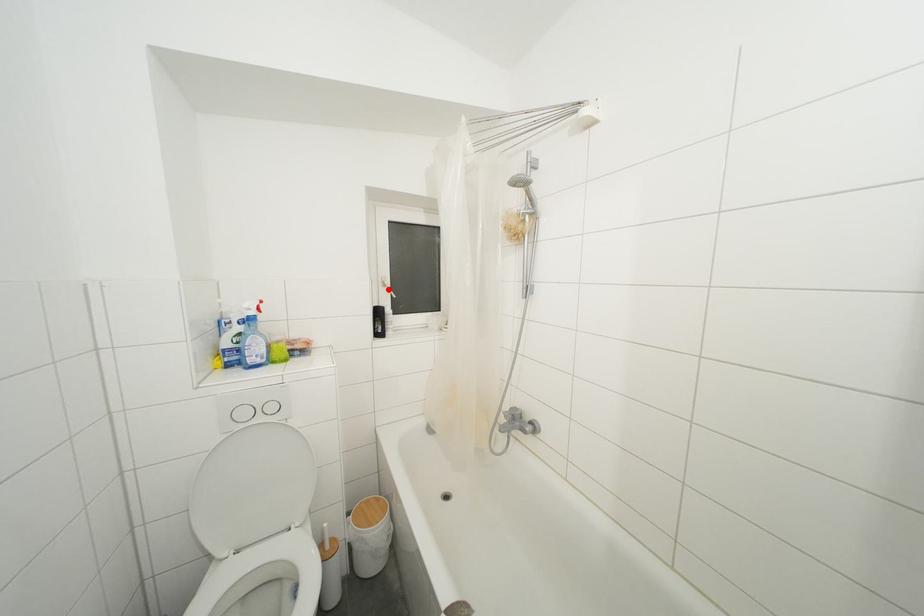
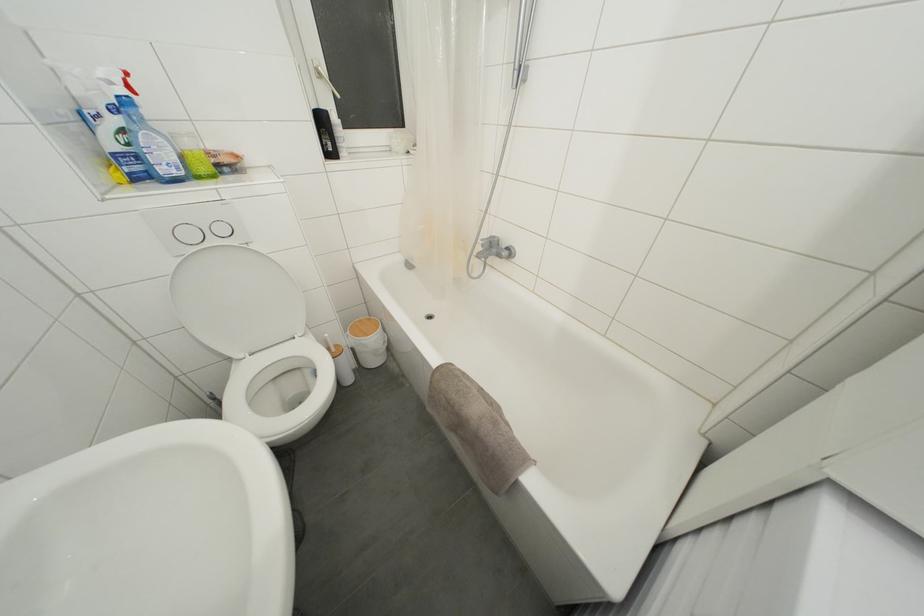
In the second image, find the point that corresponds to the highlighted location in the first image.

(323, 79)